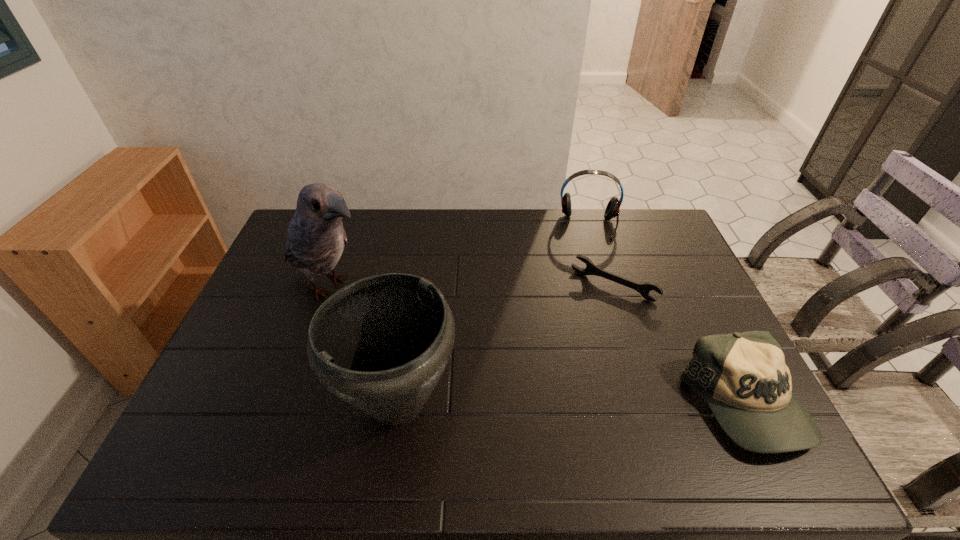
The width and height of the screenshot is (960, 540). I want to click on baseball cap positioned at the right edge, so click(x=743, y=377).

At what (x,y) coordinates should I click in order to perform the action: click on wrench that is positioned at the right edge. Please return your answer as a coordinate pair (x, y). Looking at the image, I should click on (591, 269).

At what (x,y) coordinates should I click in order to perform the action: click on object at the near right corner. Please return your answer as a coordinate pair (x, y). Looking at the image, I should click on (743, 377).

In the image, there is a desktop. Where is `free space at the far edge`? This screenshot has height=540, width=960. free space at the far edge is located at coordinates (568, 231).

Find the location of a particular element. Image resolution: width=960 pixels, height=540 pixels. free space at the near edge is located at coordinates (262, 420).

You are a GUI agent. You are given a task and a screenshot of the screen. Output one action in this format:
    pyautogui.click(x=<x>, y=<y>)
    Task: Click on the free space at the left edge of the desktop
    This screenshot has width=960, height=540.
    Given the screenshot: What is the action you would take?
    pyautogui.click(x=244, y=375)

I want to click on vacant region at the right edge, so click(x=671, y=259).

In the image, there is a desktop. At what (x,y) coordinates should I click in order to perform the action: click on free space at the far right corner. Please return your answer as a coordinate pair (x, y). Looking at the image, I should click on (664, 241).

The image size is (960, 540). In order to click on free space between the parrot and the baseball cap in this screenshot , I will do `click(538, 346)`.

The image size is (960, 540). Find the location of `free space between the wrench and the second shortest object`. free space between the wrench and the second shortest object is located at coordinates (679, 346).